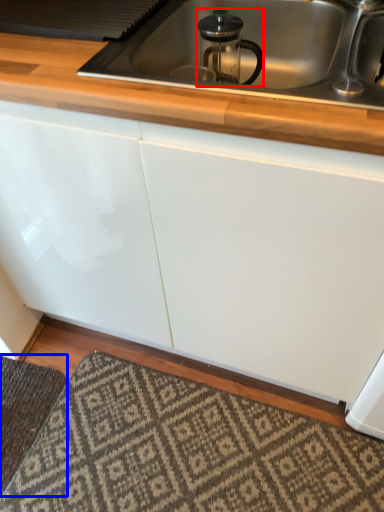
Question: Which object is closer to the camera taking this photo, appliance (highlighted by a red box) or doormat (highlighted by a blue box)?

Choices:
 (A) appliance
 (B) doormat

Answer: (A)